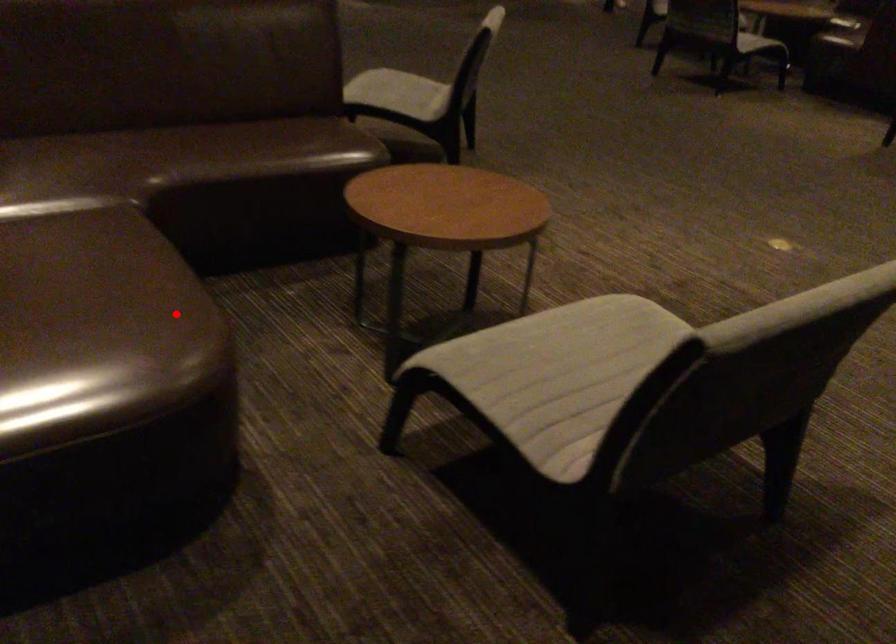
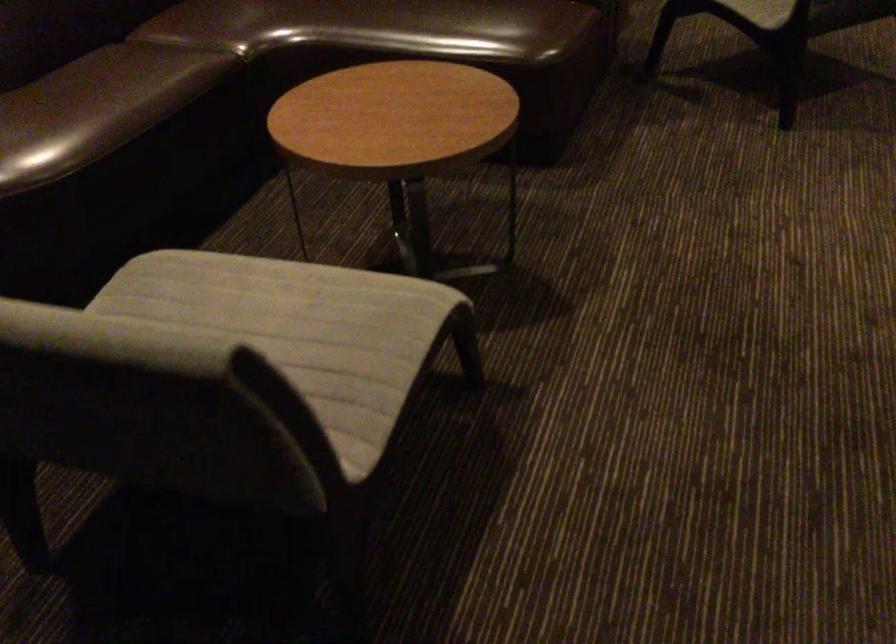
Locate, in the second image, the point that corresponds to the highlighted location in the first image.

(42, 138)